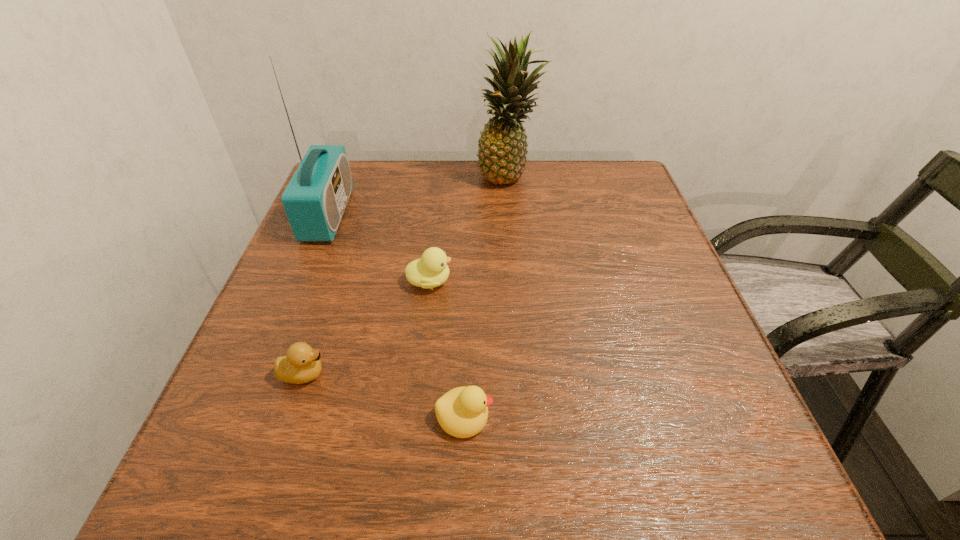
At what (x,y) coordinates should I click in order to perform the action: click on vacant space at the near left corner. Please return your answer as a coordinate pair (x, y). This screenshot has height=540, width=960. Looking at the image, I should click on (296, 463).

Find the location of a particular element. This screenshot has height=540, width=960. vacant space at the far right corner of the desktop is located at coordinates (599, 159).

This screenshot has width=960, height=540. I want to click on vacant space at the near right corner, so click(x=695, y=443).

I want to click on vacant space that's between the nearest duckling and the radio receiver, so click(396, 315).

Identify the location of vacant space in between the radio receiver and the third nearest object. Image resolution: width=960 pixels, height=540 pixels. (379, 248).

At what (x,y) coordinates should I click in order to perform the action: click on free space between the leftmost duckling and the pineapple. Please return your answer as a coordinate pair (x, y). The image size is (960, 540). Looking at the image, I should click on coord(406,275).

Where is `empty space that is in between the second nearest duckling and the radio receiver`? This screenshot has height=540, width=960. empty space that is in between the second nearest duckling and the radio receiver is located at coordinates [x=316, y=294].

Locate an element on the screen. The image size is (960, 540). free space between the fourth farthest object and the pineapple is located at coordinates (406, 275).

In order to click on empty space between the third nearest object and the pineapple in this screenshot , I will do `click(468, 228)`.

At what (x,y) coordinates should I click in order to perform the action: click on vacant area that lies between the pineapple and the leftmost duckling. Please return your answer as a coordinate pair (x, y). This screenshot has width=960, height=540. Looking at the image, I should click on (406, 275).